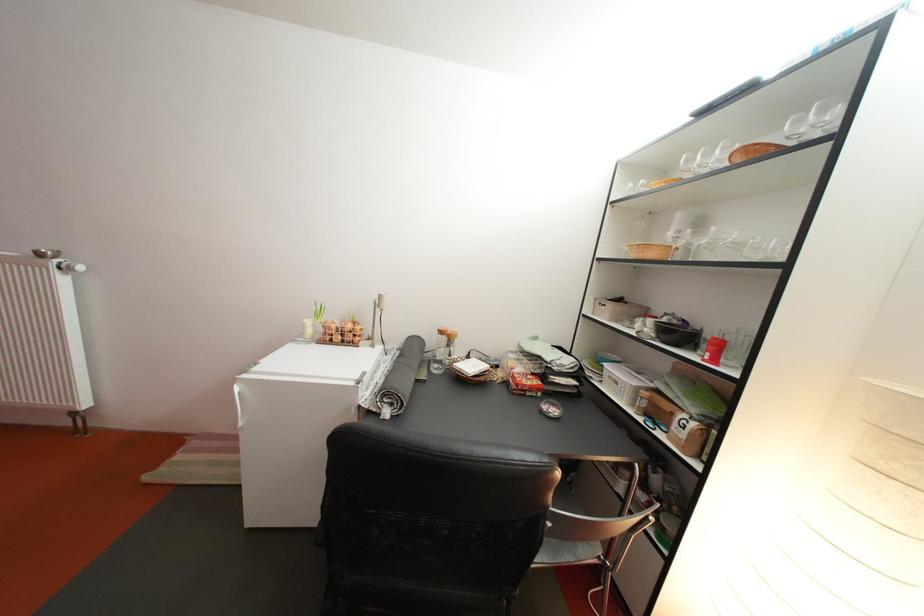
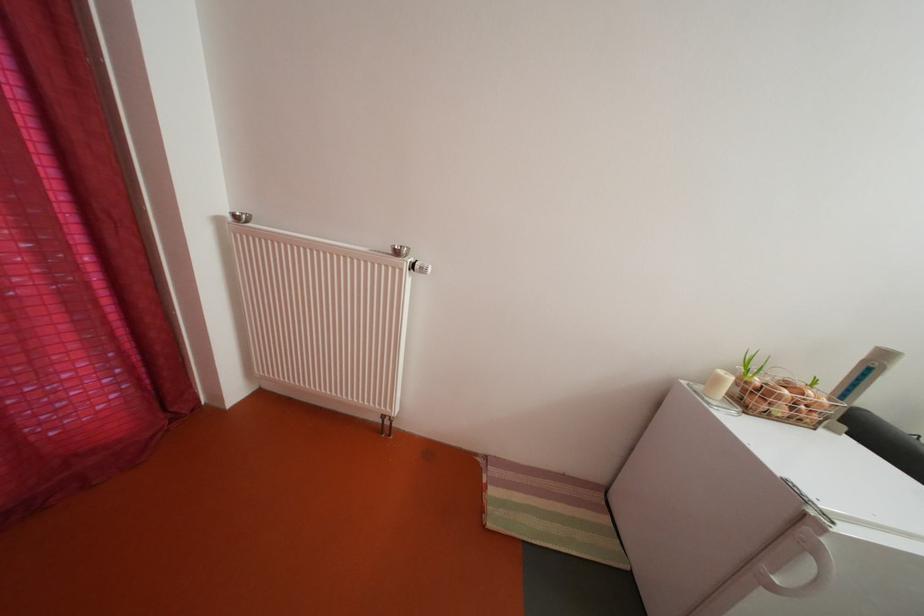
The point at (348, 344) is marked in the first image. Where is the corresponding point in the second image?

(792, 416)